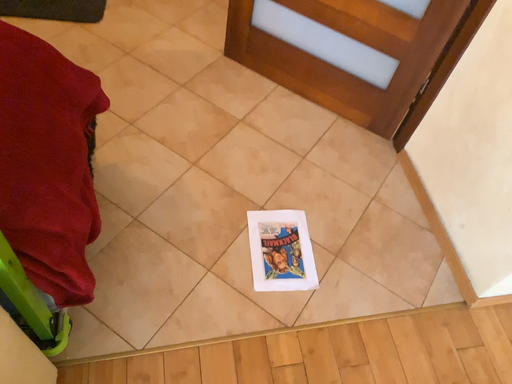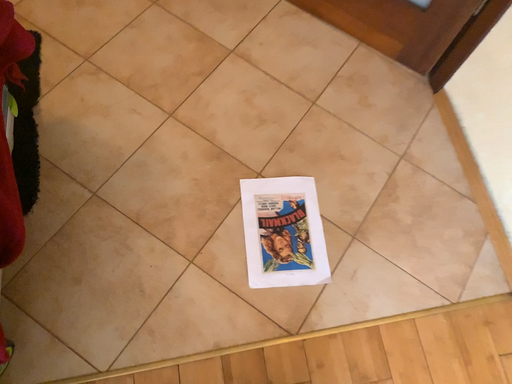
Question: Which way did the camera rotate in the video?

Choices:
 (A) rotated upward
 (B) rotated downward

Answer: (B)